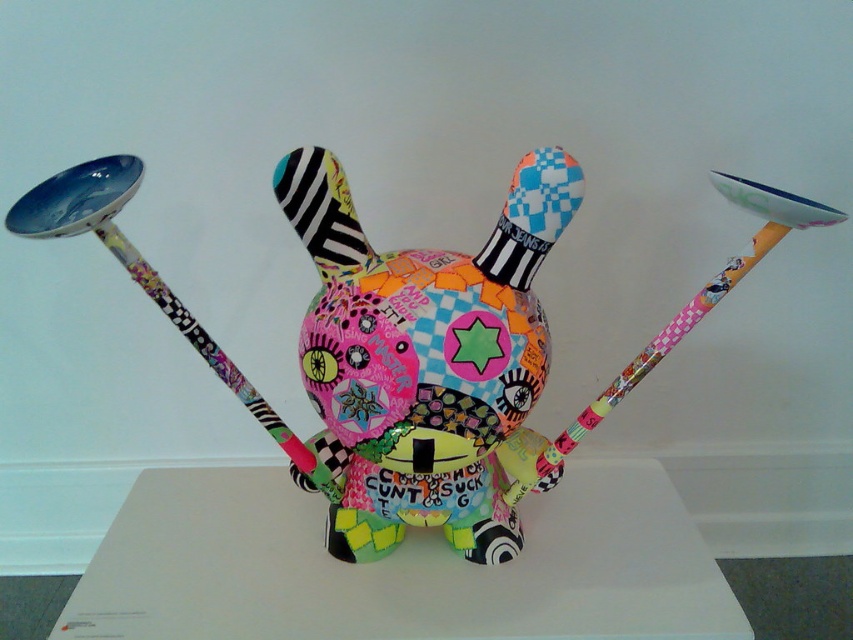
You are an art curator planning to install a new sculpture in a gallery. The existing art piece has a multicolored fabric toy at center at point (413, 344). If you want to place a new sculpture 0.3 units to the right of this point, what coordinate would that be?

The new sculpture should be placed at coordinate 0.839, 0.485 because adding 0.3 to the x coordinate of the multicolored fabric toy at center at point (413, 344) gives 0.539 plus 0.3 equals 0.839.

You are an art restorer examining the colorful art piece. You notice two points on the artwork at coordinates point [508,548] and point [473,426]. Which point is closer to you when viewed from the front?

Point [508,548] is further to the viewer than point [473,426], so point [473,426] is closer to you.